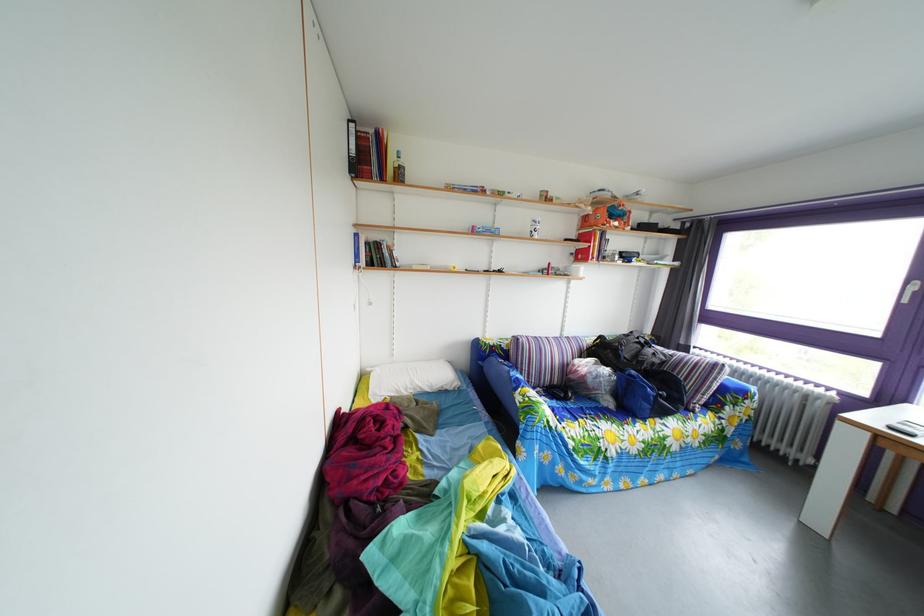
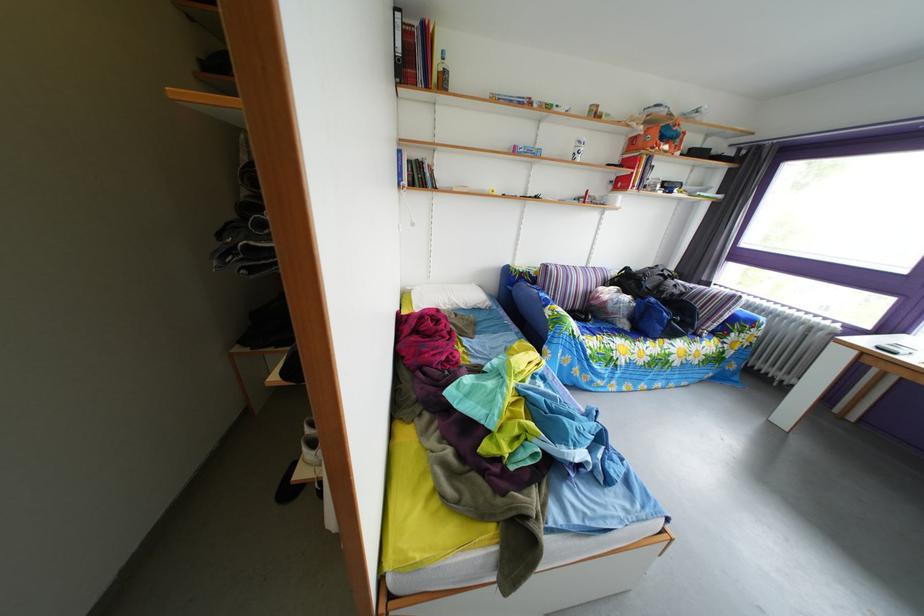
Find the pixel in the second image that matches (x=573, y=339) in the first image.

(599, 270)